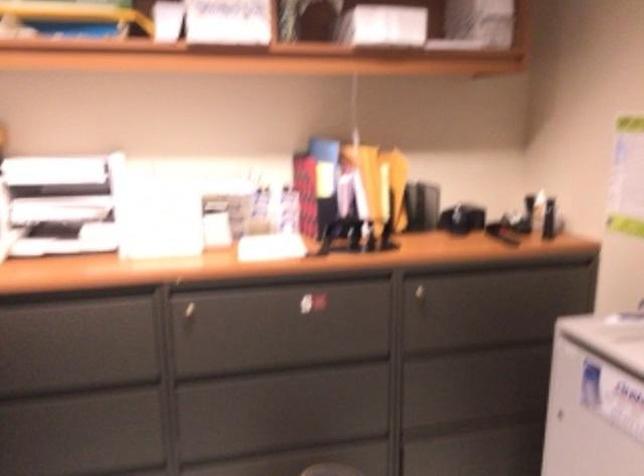
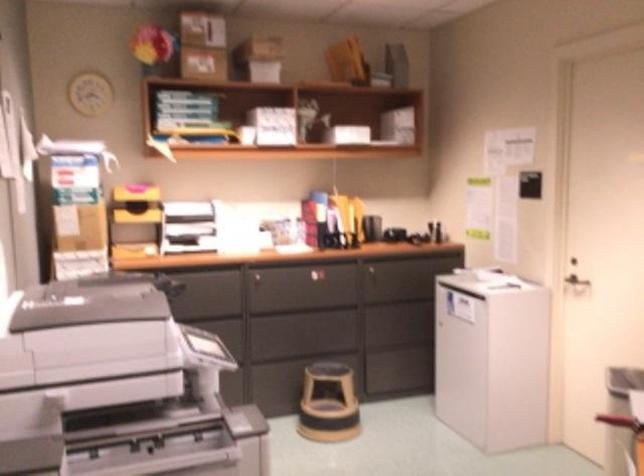
Where in the second image is the point corresponding to (x=422, y=197) from the first image?

(374, 222)